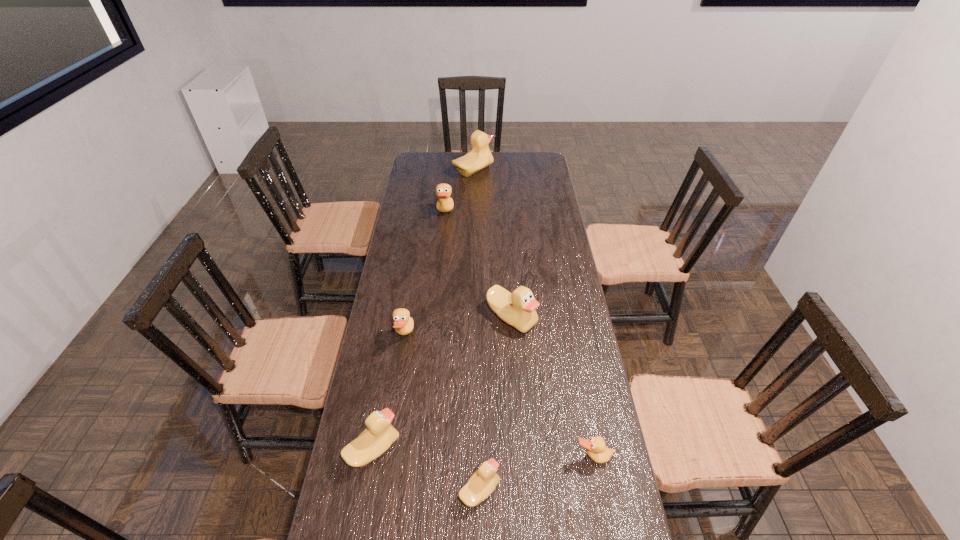
The width and height of the screenshot is (960, 540). In the image, there is a desktop. What are the coordinates of `vacant space at the far edge` in the screenshot? It's located at (508, 156).

You are a GUI agent. You are given a task and a screenshot of the screen. Output one action in this format:
    pyautogui.click(x=<x>, y=<y>)
    Task: Click on the vacant area at the left edge
    
    Given the screenshot: What is the action you would take?
    pyautogui.click(x=420, y=195)

This screenshot has width=960, height=540. In the image, there is a desktop. Find the location of `blank space at the right edge`. blank space at the right edge is located at coordinates (547, 202).

I want to click on unoccupied area between the second biggest beige duck and the nearest tan duck, so click(552, 387).

The image size is (960, 540). Identify the location of vacant area between the smallest tan duck and the sixth nearest object. (519, 335).

This screenshot has width=960, height=540. I want to click on free space that is in between the second farthest tan duck and the second smallest beige duck, so click(389, 392).

Identify the location of free spot between the smallest beige duck and the second smallest tan duck. (443, 413).

Locate an element on the screen. empty space between the second smallest beige duck and the second biggest tan duck is located at coordinates (389, 392).

Locate an element on the screen. empty location between the farthest tan duck and the biggest beige duck is located at coordinates (459, 192).

What are the coordinates of `vacant area that lies between the farthest beige duck and the second biggest tan duck` in the screenshot? It's located at (439, 253).